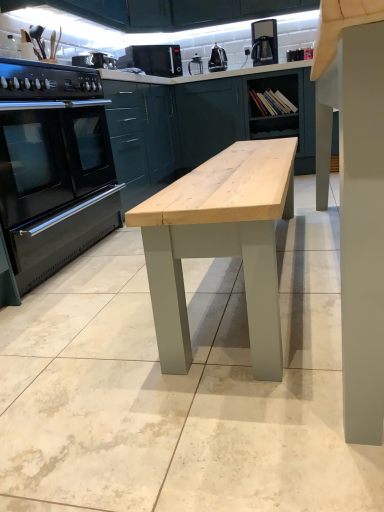
What do you see at coordinates (181, 387) in the screenshot? The width and height of the screenshot is (384, 512). I see `natural wood table at center` at bounding box center [181, 387].

Measure the distance between black plastic coffee machine at upper center and camera.

black plastic coffee machine at upper center and camera are 3.65 meters apart from each other.

You are a GUI agent. You are given a task and a screenshot of the screen. Output one action in this format:
    pyautogui.click(x=<x>, y=<y>)
    Task: Click on the black stainless steel oven at left
    The image size is (384, 512).
    Given the screenshot: What is the action you would take?
    pyautogui.click(x=53, y=167)

The image size is (384, 512). In order to click on black matte gas stove at left in this screenshot , I will do `click(47, 81)`.

Is metallic silver toaster at upper center, the second appliance viewed from the back, taller than metallic silver kettle at upper center, which ranks as the 1th appliance in top-to-bottom order?

No, metallic silver toaster at upper center, the second appliance viewed from the back, is not taller than metallic silver kettle at upper center, which ranks as the 1th appliance in top-to-bottom order.

Which object is positioned more to the left, metallic silver toaster at upper center, the second appliance viewed from the back, or metallic silver kettle at upper center, the first appliance from the back?

Positioned to the left is metallic silver toaster at upper center, the second appliance viewed from the back.

Where is `appliance that appears below the metallic silver toaster at upper center, which is the first appliance from left to right (from a real-world perspective)`? This screenshot has height=512, width=384. appliance that appears below the metallic silver toaster at upper center, which is the first appliance from left to right (from a real-world perspective) is located at coordinates (217, 59).

Between metallic silver toaster at upper center, which is counted as the first appliance, starting from the bottom, and metallic silver kettle at upper center, the 2th appliance positioned from the left, which one has smaller width?

metallic silver kettle at upper center, the 2th appliance positioned from the left, is thinner.

Which is behind, metallic silver toaster at upper center, which appears as the second appliance when viewed from the top, or natural wood table at center?

metallic silver toaster at upper center, which appears as the second appliance when viewed from the top, is behind.

Could you measure the distance between metallic silver toaster at upper center, the second appliance viewed from the right, and natural wood table at center?

A distance of 5.55 feet exists between metallic silver toaster at upper center, the second appliance viewed from the right, and natural wood table at center.

Considering the positions of points (77, 65) and (189, 276), is point (77, 65) closer to camera compared to point (189, 276)?

No, it is not.

From the image's perspective, is metallic silver toaster at upper center, which appears as the second appliance when viewed from the top, on top of natural wood table at center?

Yes.

From the picture: Looking at their sizes, would you say metallic silver kettle at upper center, the first appliance viewed from the right, is wider or thinner than metallic silver toaster at upper center, the 1th appliance positioned from the front?

metallic silver kettle at upper center, the first appliance viewed from the right, is thinner than metallic silver toaster at upper center, the 1th appliance positioned from the front.

Is point (225, 52) positioned in front of point (93, 65)?

No, it is behind (93, 65).

In the scene shown: Can you see metallic silver kettle at upper center, the first appliance from the back, touching metallic silver toaster at upper center, the second appliance viewed from the right?

metallic silver kettle at upper center, the first appliance from the back, and metallic silver toaster at upper center, the second appliance viewed from the right, are not in contact.

From a real-world perspective, which is physically below, metallic silver kettle at upper center, which ranks as the 1th appliance in top-to-bottom order, or metallic silver toaster at upper center, the 1th appliance positioned from the front?

In real-world perspective, metallic silver kettle at upper center, which ranks as the 1th appliance in top-to-bottom order, is lower.

Is metallic silver kettle at upper center, placed as the 2th appliance when sorted from bottom to top, facing away from black plastic coffee machine at upper center?

No, black plastic coffee machine at upper center is not at the back of metallic silver kettle at upper center, placed as the 2th appliance when sorted from bottom to top.

Consider the image. How many degrees apart are the facing directions of metallic silver kettle at upper center, the first appliance viewed from the right, and black plastic coffee machine at upper center?

6 degrees separate the facing orientations of metallic silver kettle at upper center, the first appliance viewed from the right, and black plastic coffee machine at upper center.

Considering the sizes of objects metallic silver kettle at upper center, the 2th appliance positioned from the left, and black plastic coffee machine at upper center in the image provided, who is thinner, metallic silver kettle at upper center, the 2th appliance positioned from the left, or black plastic coffee machine at upper center?

metallic silver kettle at upper center, the 2th appliance positioned from the left.

From a real-world perspective, which is physically below, metallic silver kettle at upper center, the 2th appliance positioned from the left, or black plastic coffee machine at upper center?

metallic silver kettle at upper center, the 2th appliance positioned from the left, is physically lower.

Is black matte gas stove at left thinner than black plastic coffee machine at upper center?

In fact, black matte gas stove at left might be wider than black plastic coffee machine at upper center.

Could you tell me if black matte gas stove at left is turned towards black plastic coffee machine at upper center?

No, black matte gas stove at left does not turn towards black plastic coffee machine at upper center.

Is black matte gas stove at left not close to black plastic coffee machine at upper center?

black matte gas stove at left is positioned a significant distance from black plastic coffee machine at upper center.

Does black matte gas stove at left have a smaller size compared to black plastic coffee machine at upper center?

No, black matte gas stove at left is not smaller than black plastic coffee machine at upper center.

Would you say black stainless steel oven at left is inside or outside metallic silver kettle at upper center, the first appliance from the back?

black stainless steel oven at left is not enclosed by metallic silver kettle at upper center, the first appliance from the back.

Could you tell me if black stainless steel oven at left is turned towards metallic silver kettle at upper center, the first appliance from the back?

No, black stainless steel oven at left is not oriented towards metallic silver kettle at upper center, the first appliance from the back.

Is black stainless steel oven at left thinner than metallic silver kettle at upper center, which ranks as the 1th appliance in top-to-bottom order?

Incorrect, the width of black stainless steel oven at left is not less than that of metallic silver kettle at upper center, which ranks as the 1th appliance in top-to-bottom order.

Which is more to the right, black stainless steel oven at left or metallic silver kettle at upper center, the 2th appliance positioned from the left?

Positioned to the right is metallic silver kettle at upper center, the 2th appliance positioned from the left.

Does point (130, 47) appear closer or farther from the camera than point (85, 64)?

Point (130, 47).

Who is shorter, black matte microwave at upper center or metallic silver toaster at upper center, which appears as the second appliance when viewed from the top?

metallic silver toaster at upper center, which appears as the second appliance when viewed from the top, is shorter.

Find the location of a particular element. The image size is (384, 512). kitchen appliance behind the metallic silver toaster at upper center, which is the first appliance from left to right is located at coordinates (153, 59).

Is black matte microwave at upper center positioned far away from metallic silver toaster at upper center, which appears as the second appliance when viewed from the top?

No.

The image size is (384, 512). Find the location of `appliance located above the metallic silver toaster at upper center, the 1th appliance positioned from the front (from the image's perspective)`. appliance located above the metallic silver toaster at upper center, the 1th appliance positioned from the front (from the image's perspective) is located at coordinates (217, 59).

Where is `concrete below the metallic silver toaster at upper center, the 1th appliance positioned from the front (from a real-world perspective)`? The image size is (384, 512). concrete below the metallic silver toaster at upper center, the 1th appliance positioned from the front (from a real-world perspective) is located at coordinates (181, 387).

From the image, which object appears to be nearer to black stainless steel oven at left, natural wood table at center or matte green cabinet at upper center?

The object closer to black stainless steel oven at left is natural wood table at center.

Based on their spatial positions, is metallic silver toaster at upper center, the 1th appliance positioned from the front, or black stainless steel oven at left closer to natural wood table at center?

black stainless steel oven at left is positioned closer to the anchor natural wood table at center.

Based on their spatial positions, is metallic silver kettle at upper center, which ranks as the 1th appliance in top-to-bottom order, or black matte microwave at upper center further from natural wood table at center?

The object further to natural wood table at center is metallic silver kettle at upper center, which ranks as the 1th appliance in top-to-bottom order.

Estimate the real-world distances between objects in this image. Which object is further from black matte microwave at upper center, natural wood table at center or black matte gas stove at left?

Based on the image, natural wood table at center appears to be further to black matte microwave at upper center.

When comparing their distances from matte green cabinet at upper center, does black matte gas stove at left or black matte microwave at upper center seem further?

black matte gas stove at left is further to matte green cabinet at upper center.

Estimate the real-world distances between objects in this image. Which object is closer to black plastic coffee machine at upper center, metallic silver toaster at upper center, the 1th appliance positioned from the front, or black matte gas stove at left?

Based on the image, metallic silver toaster at upper center, the 1th appliance positioned from the front, appears to be nearer to black plastic coffee machine at upper center.

Based on their spatial positions, is black stainless steel oven at left or black plastic coffee machine at upper center closer to black matte microwave at upper center?

Based on the image, black plastic coffee machine at upper center appears to be nearer to black matte microwave at upper center.

From the image, which object appears to be nearer to black matte gas stove at left, metallic silver kettle at upper center, the first appliance from the back, or black stainless steel oven at left?

black stainless steel oven at left.

I want to click on coffee machine between natural wood table at center and matte green cabinet at upper center from front to back, so click(264, 42).

Locate an element on the screen. This screenshot has height=512, width=384. appliance between natural wood table at center and black plastic coffee machine at upper center from front to back is located at coordinates pos(95,60).

You are a GUI agent. You are given a task and a screenshot of the screen. Output one action in this format:
    pyautogui.click(x=<x>, y=<y>)
    Task: Click on the appliance between black stainless steel oven at left and black matte microwave at upper center along the z-axis
    The width and height of the screenshot is (384, 512).
    Given the screenshot: What is the action you would take?
    point(95,60)

This screenshot has height=512, width=384. What are the coordinates of `appliance between black matte gas stove at left and black matte microwave at upper center in the front-back direction` in the screenshot? It's located at pos(95,60).